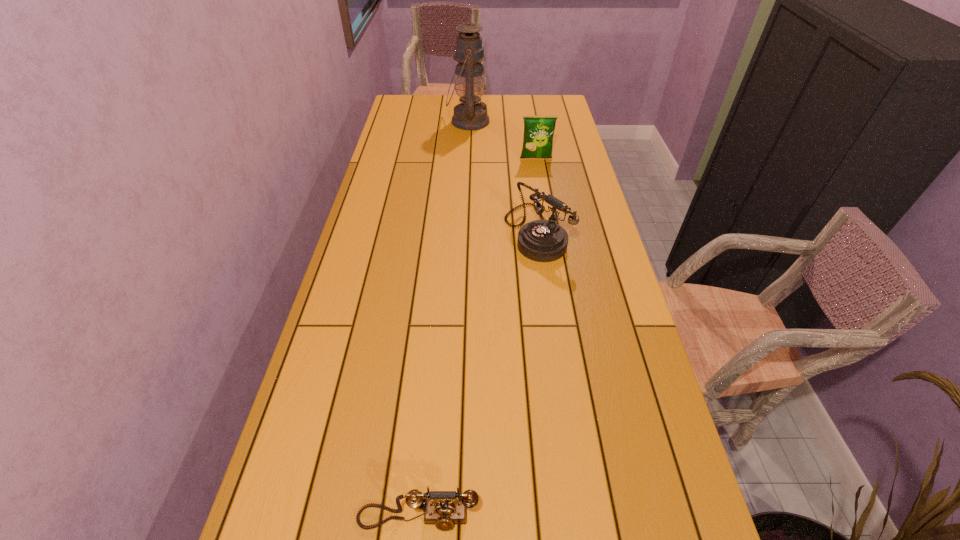
Identify the location of free space between the oil lamp and the second farthest object. This screenshot has height=540, width=960. coord(502,140).

You are a GUI agent. You are given a task and a screenshot of the screen. Output one action in this format:
    pyautogui.click(x=<x>, y=<y>)
    Task: Click on the vacant space that's between the left telephone and the second farthest object
    This screenshot has height=540, width=960.
    Given the screenshot: What is the action you would take?
    pyautogui.click(x=477, y=339)

Locate an element on the screen. Image resolution: width=960 pixels, height=540 pixels. free spot between the crisp (potato chip) and the tallest object is located at coordinates (502, 140).

What are the coordinates of `vacant area that lies between the nearest object and the third nearest object` in the screenshot? It's located at (477, 339).

Where is `vacant space in between the oil lamp and the shortest object`? The width and height of the screenshot is (960, 540). vacant space in between the oil lamp and the shortest object is located at coordinates (444, 320).

At what (x,y) coordinates should I click in order to perform the action: click on vacant space in between the second nearest object and the shortest object. Please return your answer as a coordinate pair (x, y). Looking at the image, I should click on (477, 375).

The image size is (960, 540). I want to click on object that stands as the second closest to the tallest object, so click(x=543, y=240).

Locate an element on the screen. object that is the third closest to the crisp (potato chip) is located at coordinates (444, 514).